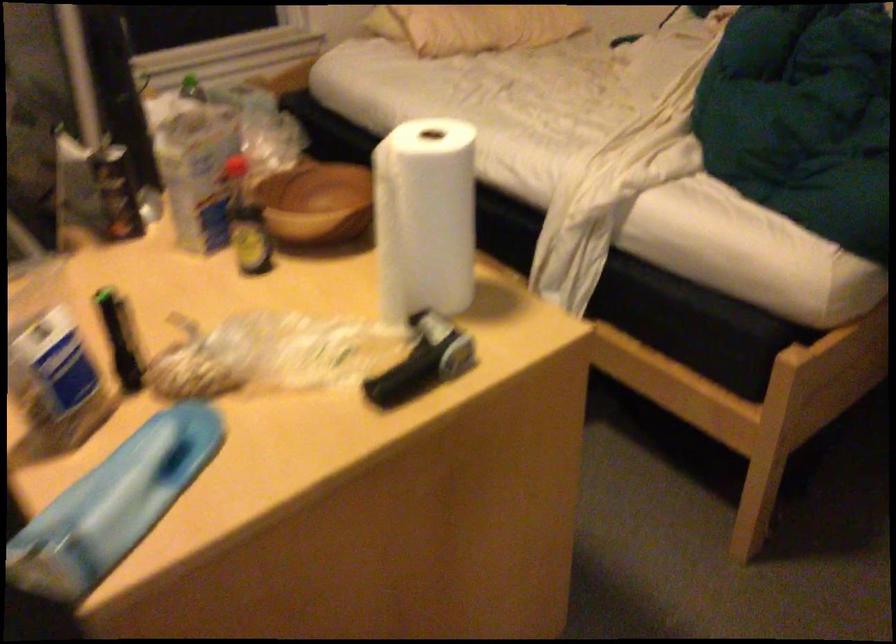
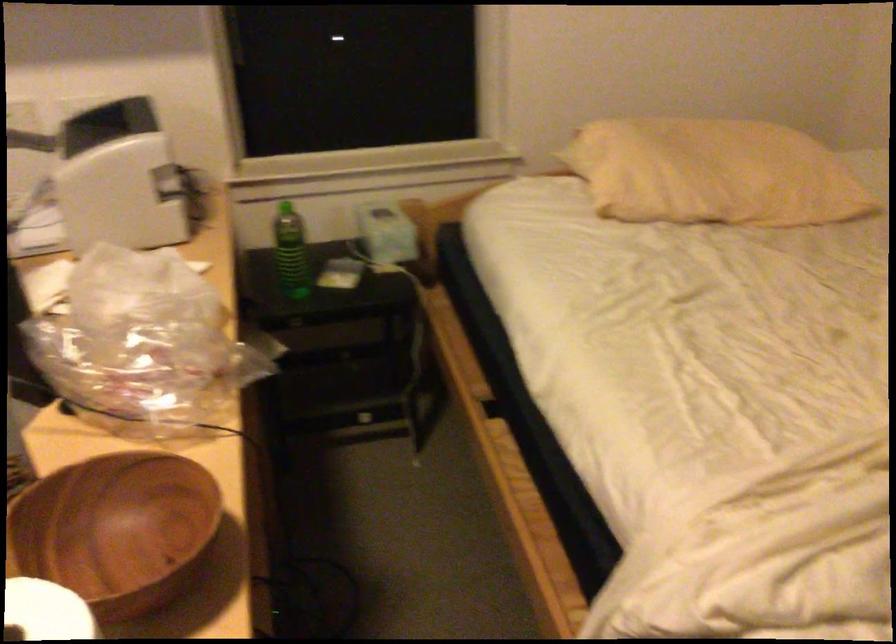
Find the pixel in the second image that matches point (296, 223) in the first image.

(117, 529)